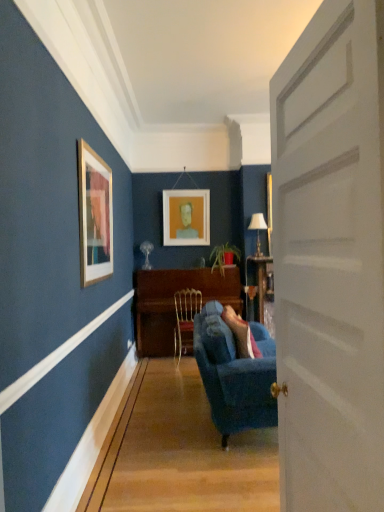
Question: Is the depth of white matte door at center greater than that of white matte picture frame at center?

Choices:
 (A) yes
 (B) no

Answer: (B)

Question: Can you confirm if white matte door at center is bigger than white matte picture frame at center?

Choices:
 (A) yes
 (B) no

Answer: (A)

Question: Does white matte door at center have a greater width compared to white matte picture frame at center?

Choices:
 (A) yes
 (B) no

Answer: (A)

Question: Is white matte door at center closer to the viewer compared to white matte picture frame at center?

Choices:
 (A) yes
 (B) no

Answer: (A)

Question: Is white matte door at center aimed at white matte picture frame at center?

Choices:
 (A) no
 (B) yes

Answer: (A)

Question: Is metallic gold chair at center inside the boundaries of white matte picture frame at center, or outside?

Choices:
 (A) outside
 (B) inside

Answer: (A)

Question: Is metallic gold chair at center to the left or to the right of white matte picture frame at center in the image?

Choices:
 (A) right
 (B) left

Answer: (A)

Question: Considering the positions of metallic gold chair at center and white matte picture frame at center in the image, is metallic gold chair at center taller or shorter than white matte picture frame at center?

Choices:
 (A) tall
 (B) short

Answer: (B)

Question: Considering their positions, is metallic gold chair at center located in front of or behind white matte picture frame at center?

Choices:
 (A) front
 (B) behind

Answer: (A)

Question: Would you say white matte picture frame at center is to the left or to the right of velvet blue couch at center in the picture?

Choices:
 (A) left
 (B) right

Answer: (A)

Question: From the image's perspective, is white matte picture frame at center located above or below velvet blue couch at center?

Choices:
 (A) below
 (B) above

Answer: (B)

Question: Choose the correct answer: Is white matte picture frame at center inside velvet blue couch at center or outside it?

Choices:
 (A) outside
 (B) inside

Answer: (A)

Question: Considering the positions of white matte picture frame at center and velvet blue couch at center in the image, is white matte picture frame at center taller or shorter than velvet blue couch at center?

Choices:
 (A) tall
 (B) short

Answer: (A)

Question: From a real-world perspective, is white matte picture frame at center above or below metallic gold chair at center?

Choices:
 (A) above
 (B) below

Answer: (A)

Question: Relative to metallic gold chair at center, is white matte picture frame at center in front or behind?

Choices:
 (A) behind
 (B) front

Answer: (A)